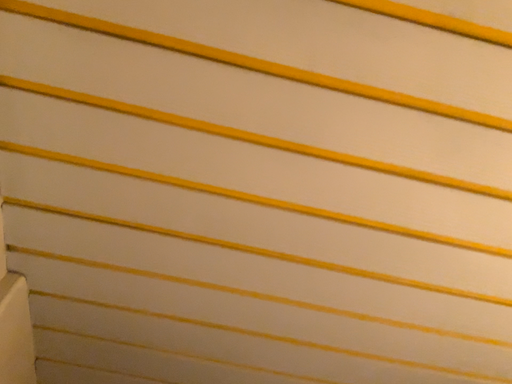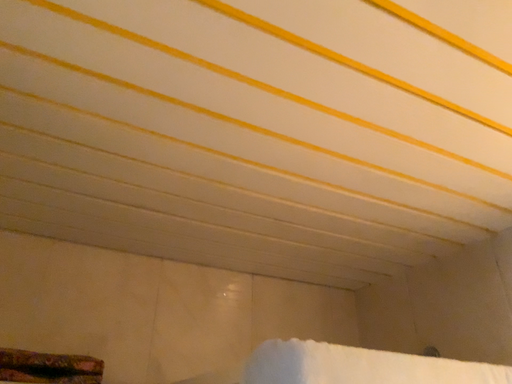
Question: Which way did the camera rotate in the video?

Choices:
 (A) rotated upward
 (B) rotated downward

Answer: (B)